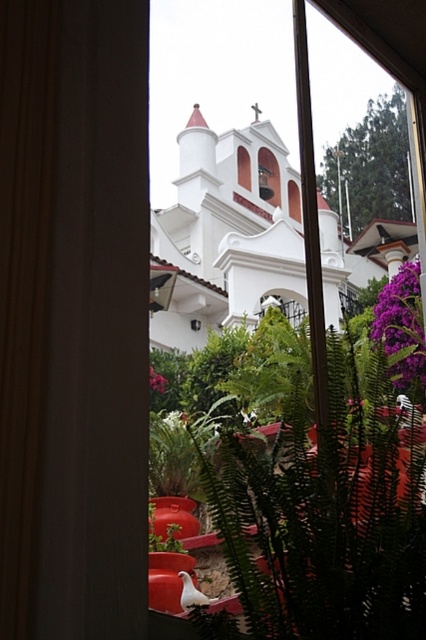
Is purple matte flower at right in front of purple matte flower at center?

No, purple matte flower at right is further to the viewer.

Does purple matte flower at right appear over purple matte flower at center?

Correct, purple matte flower at right is located above purple matte flower at center.

Does point (388, 298) lie behind point (164, 380)?

No, (388, 298) is in front of (164, 380).

You are a GUI agent. You are given a task and a screenshot of the screen. Output one action in this format:
    pyautogui.click(x=<x>, y=<y>)
    Task: Click on the purple matte flower at right
    
    Given the screenshot: What is the action you would take?
    pyautogui.click(x=402, y=324)

Can you confirm if purple matte flower at right is bigger than white glossy bird at lower center?

Yes.

What are the coordinates of `purple matte flower at right` in the screenshot? It's located at (402, 324).

Between white matte church at center and purple matte flower at right, which one appears on the left side from the viewer's perspective?

white matte church at center

In order to click on white matte church at center in this screenshot , I will do `click(227, 232)`.